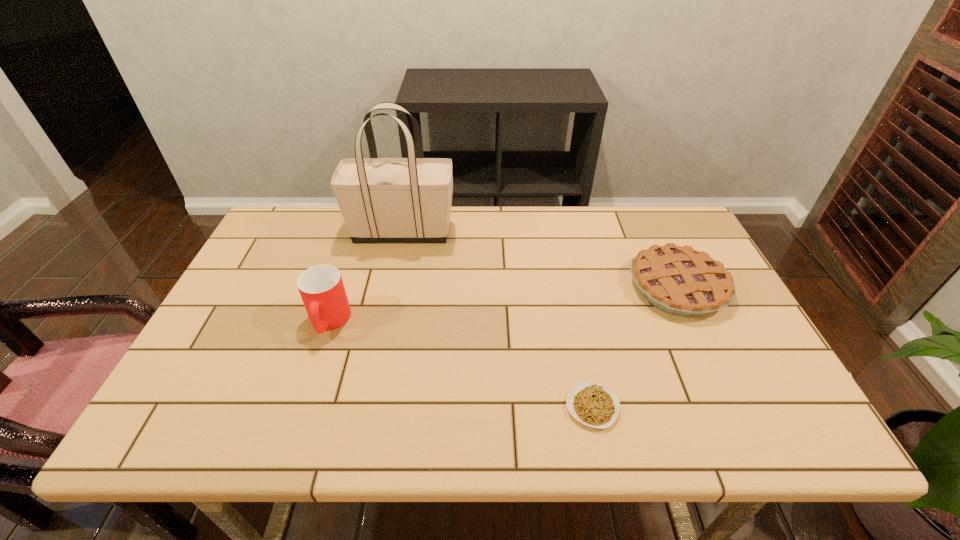
Identify which object is located as the nearest to the cup. Please provide its 2D coordinates. Your answer should be formatted as a tuple, i.e. [(x, y)], where the tuple contains the x and y coordinates of a point satisfying the conditions above.

[(382, 200)]

The height and width of the screenshot is (540, 960). I want to click on free location that satisfies the following two spatial constraints: 1. with handles facing forward on the second object from right to left; 2. on the right side of the shopping bag, so click(365, 407).

You are a GUI agent. You are given a task and a screenshot of the screen. Output one action in this format:
    pyautogui.click(x=<x>, y=<y>)
    Task: Click on the free space that satisfies the following two spatial constraints: 1. with handles facing forward on the pie; 2. on the right side of the shopping bag
    The height and width of the screenshot is (540, 960).
    Given the screenshot: What is the action you would take?
    pyautogui.click(x=391, y=287)

Find the location of `vacant space that satisfies the following two spatial constraints: 1. on the side of the third shortest object with the handle; 2. on the left side of the nearest object`. vacant space that satisfies the following two spatial constraints: 1. on the side of the third shortest object with the handle; 2. on the left side of the nearest object is located at coordinates (300, 407).

At what (x,y) coordinates should I click in order to perform the action: click on vacant space that satisfies the following two spatial constraints: 1. on the back side of the pie; 2. with handles facing forward on the shopping bag. Please return your answer as a coordinate pair (x, y). Looking at the image, I should click on (652, 231).

Locate an element on the screen. This screenshot has width=960, height=540. free location that satisfies the following two spatial constraints: 1. on the back side of the second object from right to left; 2. with handles facing forward on the shopping bag is located at coordinates (556, 231).

The width and height of the screenshot is (960, 540). Find the location of `vacant space that satisfies the following two spatial constraints: 1. with handles facing forward on the tallest object; 2. on the right side of the third tallest object`. vacant space that satisfies the following two spatial constraints: 1. with handles facing forward on the tallest object; 2. on the right side of the third tallest object is located at coordinates (391, 287).

Find the location of a particular element. The image size is (960, 540). vacant position in the image that satisfies the following two spatial constraints: 1. on the back side of the second shortest object; 2. with handles facing forward on the shopping bag is located at coordinates (652, 231).

This screenshot has width=960, height=540. What are the coordinates of `free space that satisfies the following two spatial constraints: 1. with handles facing forward on the farthest object; 2. on the right side of the pie` in the screenshot? It's located at (391, 287).

At what (x,y) coordinates should I click in order to perform the action: click on free space that satisfies the following two spatial constraints: 1. with handles facing forward on the shopping bag; 2. on the back side of the pie. Please return your answer as a coordinate pair (x, y). This screenshot has height=540, width=960. Looking at the image, I should click on (391, 287).